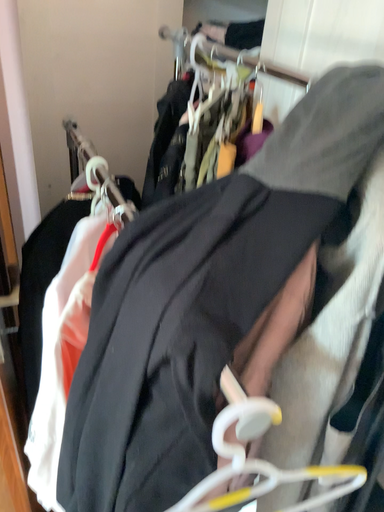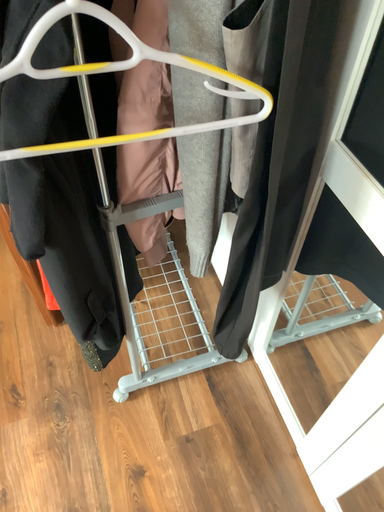
Question: How did the camera likely rotate when shooting the video?

Choices:
 (A) rotated downward
 (B) rotated upward

Answer: (A)